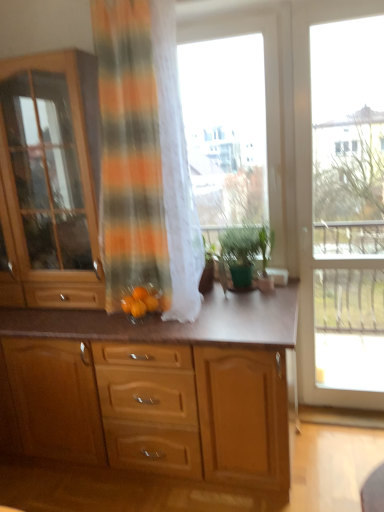
The height and width of the screenshot is (512, 384). Find the location of `free space on the front side of orange matte tangerine at center, arranged as the first tangerine when viewed from the right`. free space on the front side of orange matte tangerine at center, arranged as the first tangerine when viewed from the right is located at coordinates (160, 324).